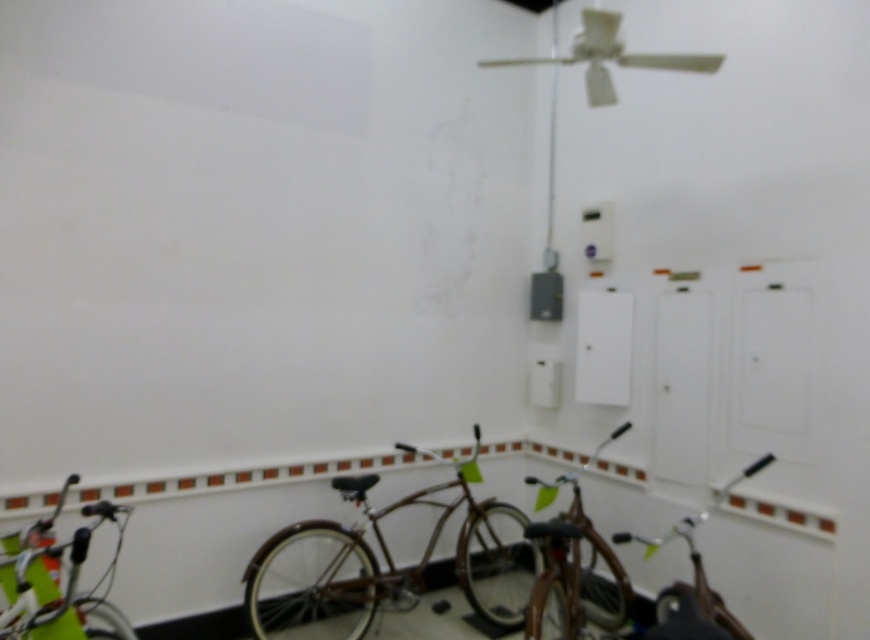
Question: From the image, what is the correct spatial relationship of white glossy bicycle at lower left in relation to shiny brown bicycle at lower right?

Choices:
 (A) below
 (B) above

Answer: (B)

Question: Considering the real-world distances, which object is closest to the white glossy bicycle at lower left?

Choices:
 (A) shiny brown bicycle at lower right
 (B) shiny brown bicycle at center

Answer: (B)

Question: Estimate the real-world distances between objects in this image. Which object is farther from the shiny brown bicycle at lower right?

Choices:
 (A) white glossy bicycle at lower left
 (B) brown matte bicycle at center

Answer: (A)

Question: Does brown matte bicycle at center have a larger size compared to shiny brown bicycle at lower right?

Choices:
 (A) no
 (B) yes

Answer: (B)

Question: Is white glossy bicycle at lower left bigger than shiny brown bicycle at center?

Choices:
 (A) yes
 (B) no

Answer: (B)

Question: Which object appears farthest from the camera in this image?

Choices:
 (A) white glossy bicycle at lower left
 (B) shiny brown bicycle at center
 (C) shiny brown bicycle at lower right

Answer: (B)